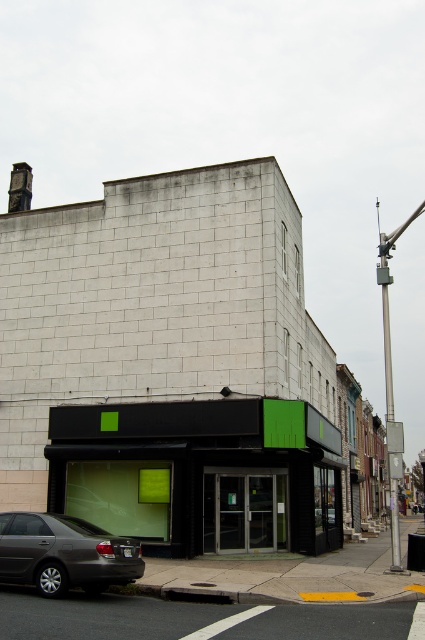
Question: Does black matte storefront at lower center appear under matte gray sedan at lower left?

Choices:
 (A) no
 (B) yes

Answer: (B)

Question: Which point is closer to the camera taking this photo?

Choices:
 (A) (79, 561)
 (B) (217, 493)

Answer: (A)

Question: Which point is closer to the camera?

Choices:
 (A) black matte storefront at lower center
 (B) matte gray sedan at lower left

Answer: (B)

Question: Is black matte storefront at lower center wider than matte gray sedan at lower left?

Choices:
 (A) no
 (B) yes

Answer: (B)

Question: Which point is farther to the camera?

Choices:
 (A) (107, 586)
 (B) (331, 442)

Answer: (B)

Question: Does black matte storefront at lower center lie in front of matte gray sedan at lower left?

Choices:
 (A) yes
 (B) no

Answer: (B)